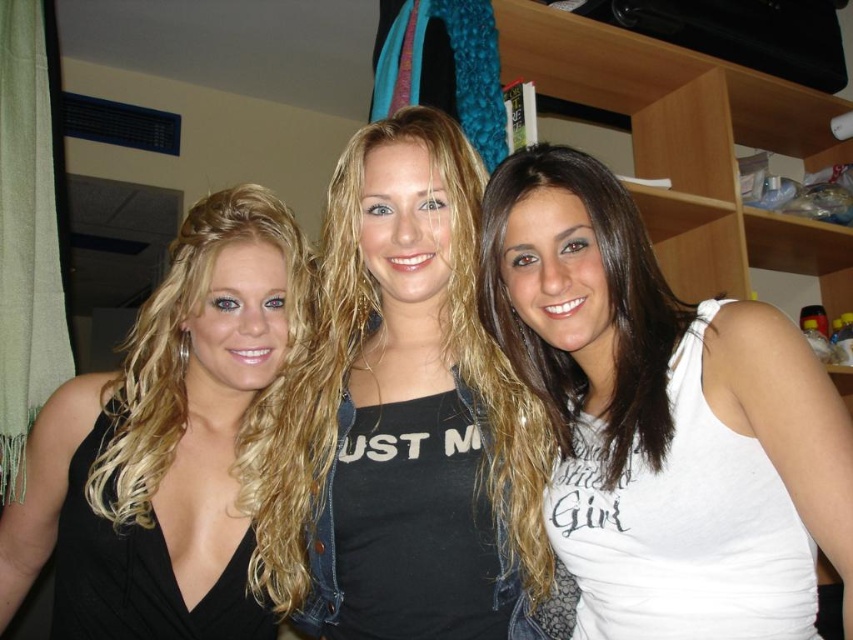
Which is more to the right, white matte tank top at center or black matte tank top at center?

Positioned to the right is white matte tank top at center.

Who is positioned more to the left, white matte tank top at center or black matte tank top at center?

From the viewer's perspective, black matte tank top at center appears more on the left side.

Identify the location of white matte tank top at center. This screenshot has height=640, width=853. (648, 380).

Where is `white matte tank top at center`? white matte tank top at center is located at coordinates (x=648, y=380).

Who is positioned more to the left, black matte dress at left or black matte tank top at center?

black matte dress at left

Does black matte dress at left come in front of black matte tank top at center?

No, black matte dress at left is behind black matte tank top at center.

Describe the element at coordinates (180, 449) in the screenshot. I see `black matte dress at left` at that location.

Image resolution: width=853 pixels, height=640 pixels. I want to click on black matte dress at left, so [x=180, y=449].

Is the position of black matte dress at left more distant than that of white matte tank top at center?

Yes, it is.

Describe the element at coordinates (180, 449) in the screenshot. This screenshot has width=853, height=640. I see `black matte dress at left` at that location.

Is point (293, 417) farther from viewer compared to point (693, 404)?

Yes, it is behind point (693, 404).

What are the coordinates of `black matte dress at left` in the screenshot? It's located at (180, 449).